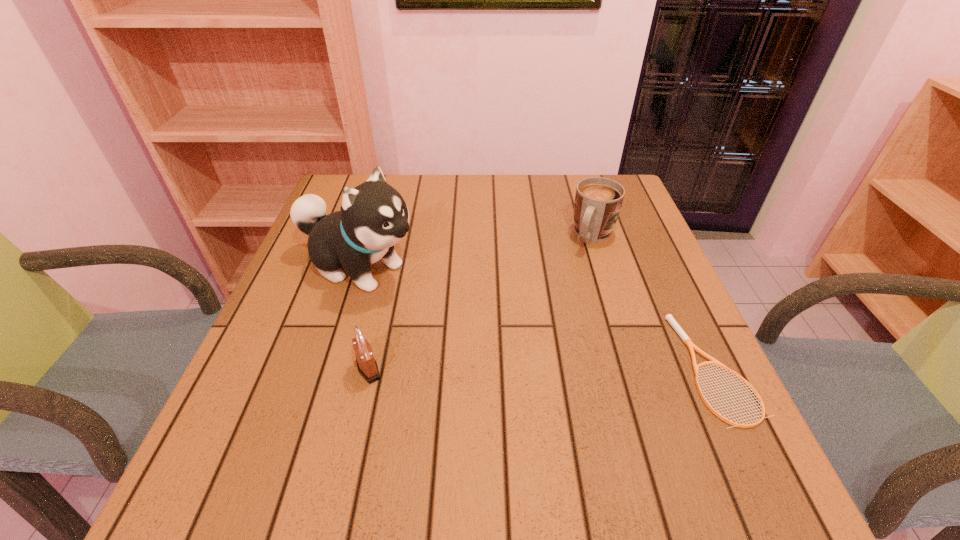
Locate an element on the screen. The height and width of the screenshot is (540, 960). vacant position at the far edge of the desktop is located at coordinates (439, 186).

At what (x,y) coordinates should I click in order to perform the action: click on vacant space at the left edge of the desktop. Please return your answer as a coordinate pair (x, y). This screenshot has height=540, width=960. Looking at the image, I should click on (341, 268).

Identify the location of vacant space at the right edge of the desktop. This screenshot has height=540, width=960. (686, 325).

The height and width of the screenshot is (540, 960). In the image, there is a desktop. Identify the location of vacant space at the far left corner. (332, 199).

This screenshot has height=540, width=960. In order to click on free region at the near left corner of the desktop in this screenshot , I will do `click(248, 399)`.

Locate an element on the screen. The width and height of the screenshot is (960, 540). vacant space at the far right corner of the desktop is located at coordinates (621, 211).

This screenshot has width=960, height=540. Find the location of `free area in between the mug and the tennis racket`. free area in between the mug and the tennis racket is located at coordinates (655, 302).

You are a GUI agent. You are given a task and a screenshot of the screen. Output one action in this format:
    pyautogui.click(x=<x>, y=<y>)
    Task: Click on the vacant region between the padlock and the shortest object
    
    Given the screenshot: What is the action you would take?
    pyautogui.click(x=541, y=368)

Where is `free area in between the shortest object and the puppy`? The height and width of the screenshot is (540, 960). free area in between the shortest object and the puppy is located at coordinates (537, 318).

Locate an element on the screen. The image size is (960, 540). free space between the second object from right to left and the tennis racket is located at coordinates (655, 302).